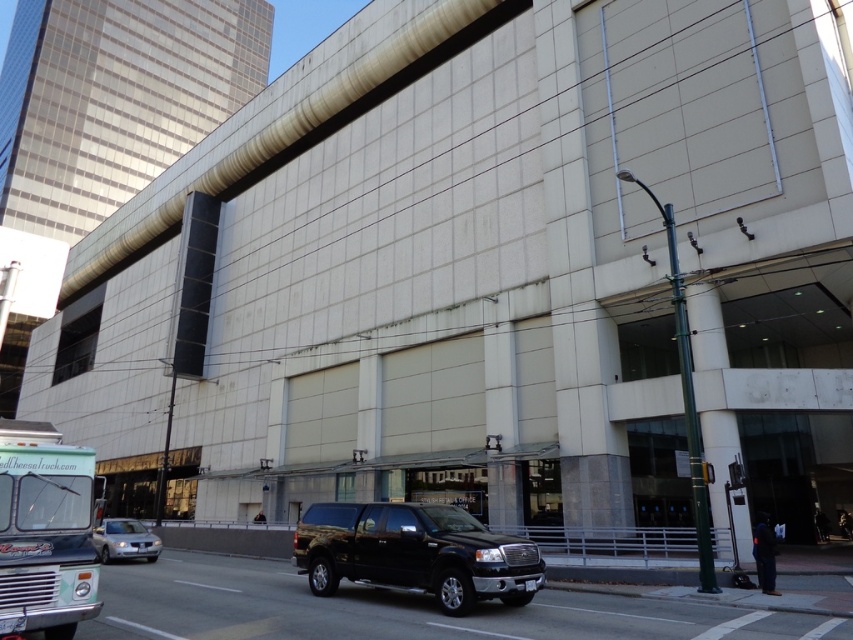
You are standing at the center of the sidewalk in front of the building. You need to walk to the teal matte bus at lower left. Which direction should you walk?

The teal matte bus at lower left is located at point (45, 531), so you should walk to the left and slightly forward to reach it.

You are standing at point (343, 534) and want to walk to the entrance of the building. The entrance is 10.76 meters away. If you can walk 1.5 meters per second, how many seconds will it take you to reach the entrance?

The entrance is 10.76 meters away, and you walk at 1.5 meters per second. To calculate the time, divide the distance by speed. 10.76 divided by 1.5 equals approximately 7.17 seconds. So, it will take roughly 7.17 seconds to reach the entrance.

You are a delivery person trying to park your van, which is 2 meters wide, between the black metallic suv at center and the silver metallic sedan at lower left. Based on the scene, can your van fit in the space between them?

The black metallic suv at center has a lesser width compared to silver metallic sedan at lower left, so the space between them may be sufficient for your 2 meter wide van. However, since the exact distance isn not provided, it depends on the available space between the two vehicles.